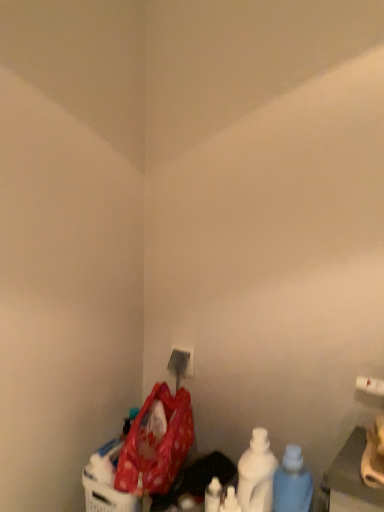
Question: Is polka dot fabric bag at lower left far from white matte bottle at lower right, which ranks as the second bottle in left-to-right order?

Choices:
 (A) no
 (B) yes

Answer: (A)

Question: Can you confirm if polka dot fabric bag at lower left is smaller than white matte bottle at lower right, acting as the second bottle starting from the right?

Choices:
 (A) no
 (B) yes

Answer: (A)

Question: Is polka dot fabric bag at lower left to the right of white matte bottle at lower right, acting as the second bottle starting from the right, from the viewer's perspective?

Choices:
 (A) yes
 (B) no

Answer: (B)

Question: Could you tell me if polka dot fabric bag at lower left is turned towards white matte bottle at lower right, acting as the second bottle starting from the right?

Choices:
 (A) yes
 (B) no

Answer: (B)

Question: Is polka dot fabric bag at lower left surrounding white matte bottle at lower right, acting as the second bottle starting from the right?

Choices:
 (A) no
 (B) yes

Answer: (A)

Question: Is blue translucent bottle at lower right, which appears as the 1th bottle when viewed from the right, bigger or smaller than polka dot fabric bag at lower left?

Choices:
 (A) big
 (B) small

Answer: (B)

Question: Looking at their shapes, would you say blue translucent bottle at lower right, the third bottle viewed from the left, is wider or thinner than polka dot fabric bag at lower left?

Choices:
 (A) wide
 (B) thin

Answer: (B)

Question: From the image's perspective, is blue translucent bottle at lower right, the third bottle viewed from the left, positioned above or below polka dot fabric bag at lower left?

Choices:
 (A) above
 (B) below

Answer: (B)

Question: In the image, is blue translucent bottle at lower right, which appears as the 1th bottle when viewed from the right, positioned in front of or behind polka dot fabric bag at lower left?

Choices:
 (A) front
 (B) behind

Answer: (A)

Question: In terms of height, does white matte bottle at lower center, positioned as the 3th bottle in right-to-left order, look taller or shorter compared to white plastic electric outlet at lower center?

Choices:
 (A) short
 (B) tall

Answer: (B)

Question: In the image, is white matte bottle at lower center, positioned as the 3th bottle in right-to-left order, positioned in front of or behind white plastic electric outlet at lower center?

Choices:
 (A) behind
 (B) front

Answer: (B)

Question: Considering the positions of white matte bottle at lower center, arranged as the first bottle when viewed from the left, and white plastic electric outlet at lower center in the image, is white matte bottle at lower center, arranged as the first bottle when viewed from the left, wider or thinner than white plastic electric outlet at lower center?

Choices:
 (A) thin
 (B) wide

Answer: (B)

Question: From the image's perspective, relative to white plastic electric outlet at lower center, is white matte bottle at lower center, positioned as the 3th bottle in right-to-left order, above or below?

Choices:
 (A) above
 (B) below

Answer: (B)

Question: From a real-world perspective, is blue translucent bottle at lower right, the third bottle viewed from the left, above or below white matte bottle at lower right, acting as the second bottle starting from the right?

Choices:
 (A) above
 (B) below

Answer: (A)

Question: Is point (289, 486) closer or farther from the camera than point (264, 486)?

Choices:
 (A) closer
 (B) farther

Answer: (A)